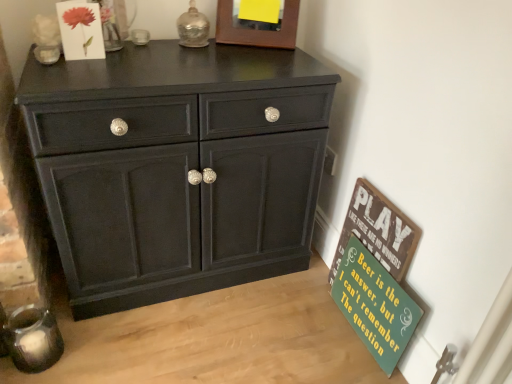
The height and width of the screenshot is (384, 512). In order to click on vacant space in front of wooden picture frame at upper center in this screenshot , I will do `click(252, 58)`.